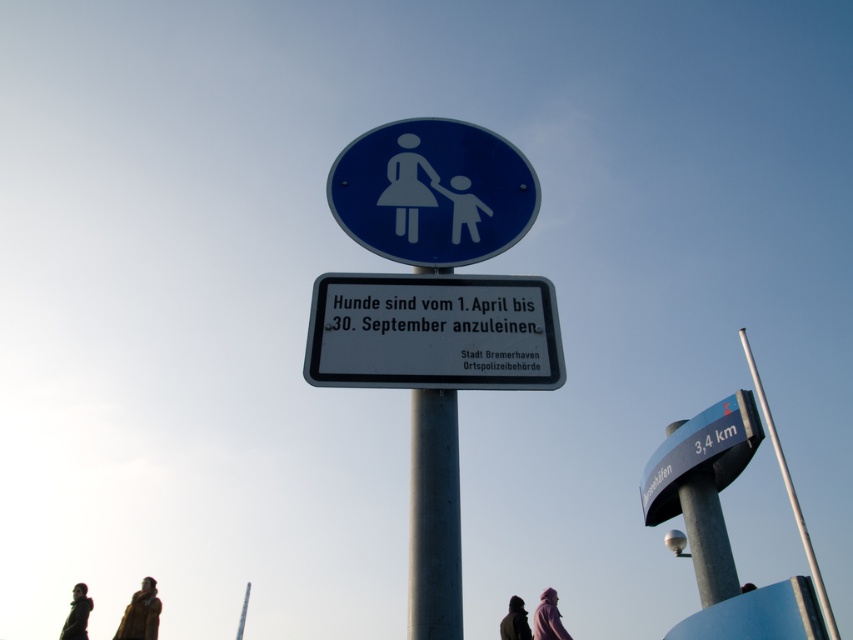
Can you confirm if silver metallic pole at center is positioned to the left of silver metallic pole at upper right?

Indeed, silver metallic pole at center is positioned on the left side of silver metallic pole at upper right.

Is point (451, 504) less distant than point (757, 381)?

Yes, point (451, 504) is in front of point (757, 381).

Where is `silver metallic pole at center`? This screenshot has width=853, height=640. silver metallic pole at center is located at coordinates (434, 516).

Which is more to the right, metallic silver signpost at right or purple fabric at lower center?

From the viewer's perspective, metallic silver signpost at right appears more on the right side.

Can you confirm if metallic silver signpost at right is positioned below purple fabric at lower center?

Actually, metallic silver signpost at right is above purple fabric at lower center.

Is point (648, 493) closer to viewer compared to point (540, 604)?

That is True.

What are the coordinates of `metallic silver signpost at right` in the screenshot? It's located at (700, 452).

Is point (534, 612) behind point (90, 602)?

No, it is in front of (90, 602).

Who is positioned more to the left, purple fabric at lower center or dark green jacket at lower left?

dark green jacket at lower left

Between point (561, 628) and point (86, 596), which one is positioned behind?

Positioned behind is point (86, 596).

I want to click on purple fabric at lower center, so click(x=548, y=618).